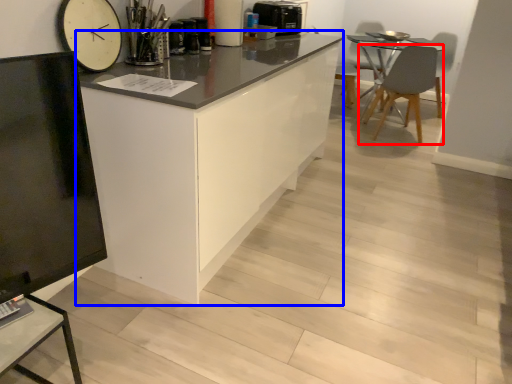
Question: Which object is further to the camera taking this photo, chair (highlighted by a red box) or cabinetry (highlighted by a blue box)?

Choices:
 (A) chair
 (B) cabinetry

Answer: (A)